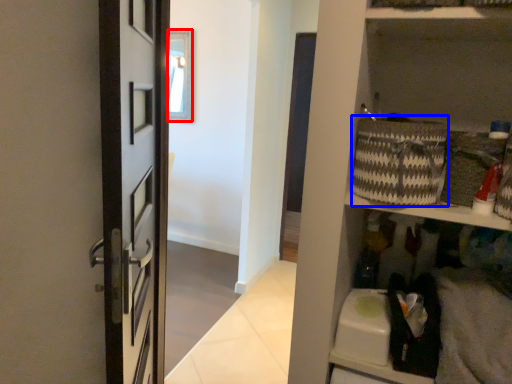
Question: Which object is further to the camera taking this photo, window (highlighted by a red box) or basket (highlighted by a blue box)?

Choices:
 (A) window
 (B) basket

Answer: (A)